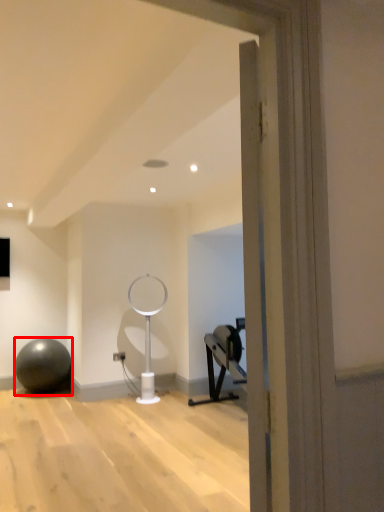
Question: From the image's perspective, where is ball (annotated by the red box) located relative to table lamp?

Choices:
 (A) below
 (B) above

Answer: (A)